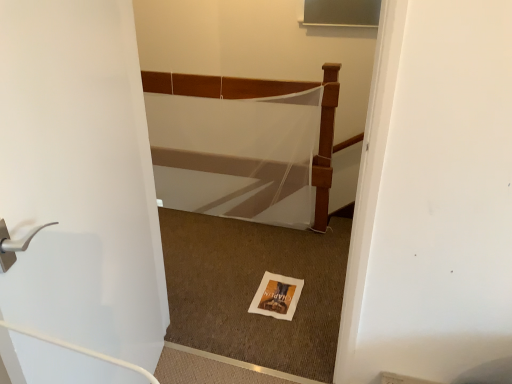
Question: Is white paper postcard at center located outside white mesh bed at center?

Choices:
 (A) yes
 (B) no

Answer: (A)

Question: Is white paper postcard at center not close to white mesh bed at center?

Choices:
 (A) no
 (B) yes

Answer: (A)

Question: From the image's perspective, is white paper postcard at center above white mesh bed at center?

Choices:
 (A) no
 (B) yes

Answer: (A)

Question: Considering the relative sizes of white paper postcard at center and white mesh bed at center in the image provided, is white paper postcard at center bigger than white mesh bed at center?

Choices:
 (A) no
 (B) yes

Answer: (A)

Question: Considering the relative sizes of white paper postcard at center and white mesh bed at center in the image provided, is white paper postcard at center shorter than white mesh bed at center?

Choices:
 (A) yes
 (B) no

Answer: (A)

Question: Considering the relative sizes of white paper postcard at center and white mesh bed at center in the image provided, is white paper postcard at center thinner than white mesh bed at center?

Choices:
 (A) no
 (B) yes

Answer: (A)

Question: Is white mesh bed at center positioned far away from white matte door at left?

Choices:
 (A) no
 (B) yes

Answer: (B)

Question: Is white mesh bed at center to the left of white matte door at left from the viewer's perspective?

Choices:
 (A) yes
 (B) no

Answer: (B)

Question: Considering the relative sizes of white mesh bed at center and white matte door at left in the image provided, is white mesh bed at center bigger than white matte door at left?

Choices:
 (A) yes
 (B) no

Answer: (A)

Question: From a real-world perspective, is white mesh bed at center positioned under white matte door at left based on gravity?

Choices:
 (A) no
 (B) yes

Answer: (B)

Question: Is white mesh bed at center shorter than white matte door at left?

Choices:
 (A) no
 (B) yes

Answer: (B)

Question: Considering the relative positions of white mesh bed at center and white matte door at left in the image provided, is white mesh bed at center behind white matte door at left?

Choices:
 (A) yes
 (B) no

Answer: (A)

Question: Is white matte door at left facing away from white mesh bed at center?

Choices:
 (A) no
 (B) yes

Answer: (A)